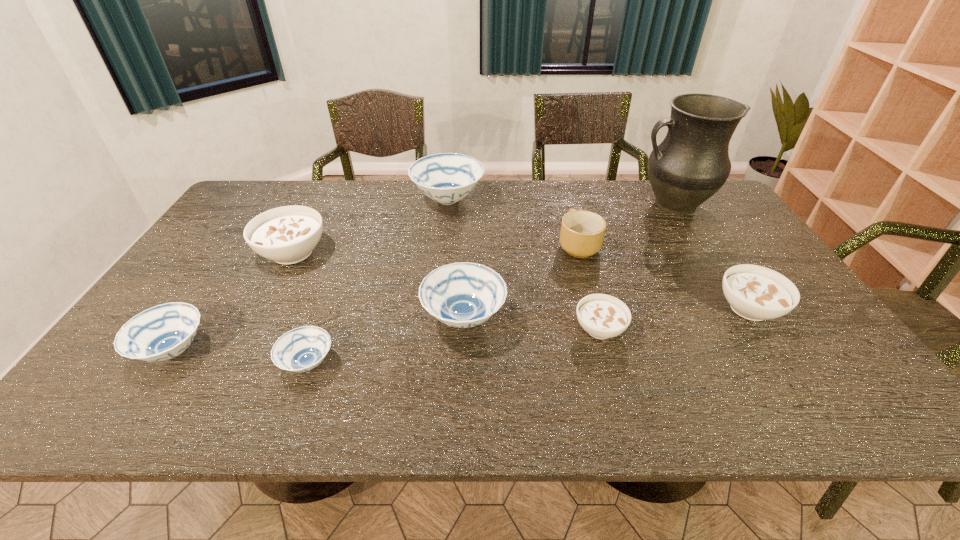
At what (x,y) coordinates should I click in order to perform the action: click on the tallest object. Please return your answer as a coordinate pair (x, y). The height and width of the screenshot is (540, 960). Looking at the image, I should click on (691, 164).

This screenshot has width=960, height=540. I want to click on pitcher, so click(691, 164).

Where is `the farthest soup bowl`? The image size is (960, 540). the farthest soup bowl is located at coordinates (446, 178).

Identify the location of the farthest blue soup bowl. The image size is (960, 540). (446, 178).

Image resolution: width=960 pixels, height=540 pixels. Identify the location of the second farthest soup bowl. (287, 235).

At what (x,y) coordinates should I click in order to perform the action: click on the leftmost white soup bowl. Please return your answer as a coordinate pair (x, y). Looking at the image, I should click on (287, 235).

I want to click on mug, so click(582, 232).

Find the location of `the third smallest blue soup bowl`. the third smallest blue soup bowl is located at coordinates (463, 295).

The image size is (960, 540). I want to click on the rightmost white soup bowl, so click(x=756, y=293).

Identify the location of the second biggest white soup bowl. The height and width of the screenshot is (540, 960). (756, 293).